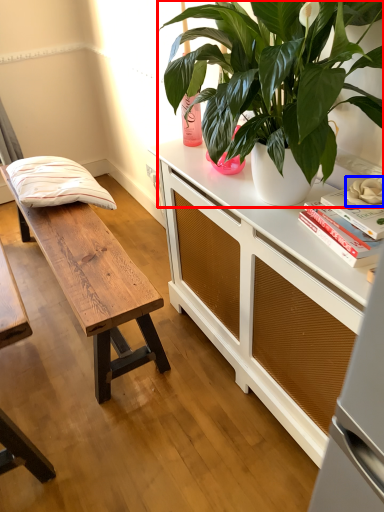
Question: Which object appears farthest to the camera in this image, houseplant (highlighted by a red box) or flower (highlighted by a blue box)?

Choices:
 (A) houseplant
 (B) flower

Answer: (B)